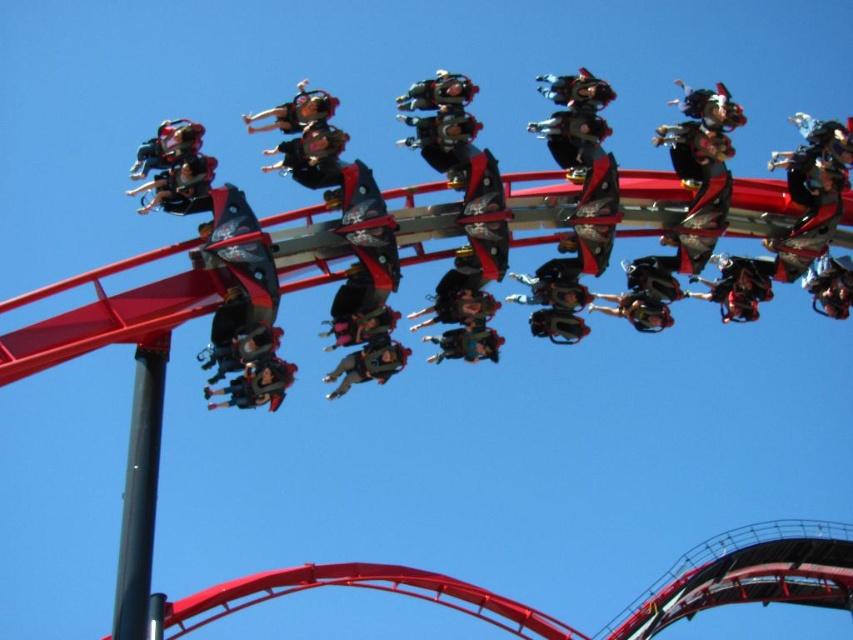
Who is positioned more to the left, matte black helmet at upper left or matte black helmet at upper center?

matte black helmet at upper left is more to the left.

Who is taller, matte black helmet at upper left or matte black helmet at upper center?

matte black helmet at upper left

Measure the distance between matte black helmet at upper left and camera.

matte black helmet at upper left and camera are 76.40 meters apart from each other.

I want to click on matte black helmet at upper left, so click(x=167, y=147).

Which is more to the left, matte black helmet at center or matte black helmet at upper center?

Positioned to the left is matte black helmet at upper center.

Does matte black helmet at center have a lesser width compared to matte black helmet at upper center?

Indeed, matte black helmet at center has a lesser width compared to matte black helmet at upper center.

What do you see at coordinates (368, 364) in the screenshot? I see `matte black helmet at center` at bounding box center [368, 364].

What are the coordinates of `matte black helmet at center` in the screenshot? It's located at (368, 364).

Measure the distance from matte black seats at center to matte black helmet at center.

The distance of matte black seats at center from matte black helmet at center is 7.98 meters.

Is point (737, 202) closer to viewer compared to point (396, 353)?

No, (737, 202) is further to viewer.

At what (x,y) coordinates should I click in order to perform the action: click on matte black seats at center. Please return your answer as a coordinate pair (x, y). Image resolution: width=853 pixels, height=640 pixels. Looking at the image, I should click on (561, 205).